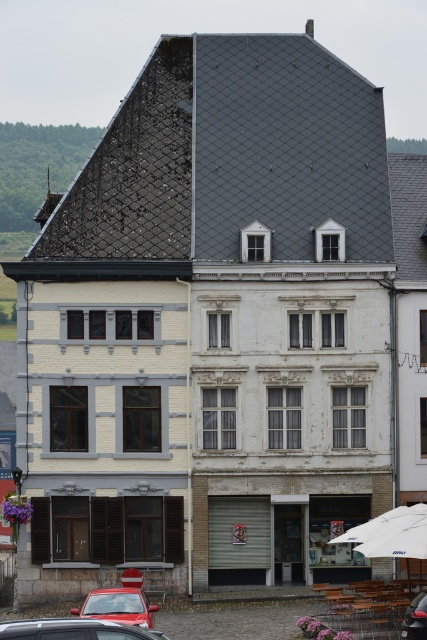
You are a delivery person trying to park your shiny red car at lower left in the parking spot next to the metallic red car at lower left. The parking spot has a height restriction of 1.7 meters. Can you safely park your car there?

The metallic red car at lower left is not as tall as the shiny red car at lower left, so the shiny red car at lower left is taller than the metallic red car at lower left. Since the parking spot has a height restriction of 1.7 meters, you need to ensure your car is under that limit. However, without knowing the exact height of your shiny red car at lower left, it is impossible to determine if it will fit within the 1.7 meter restriction.